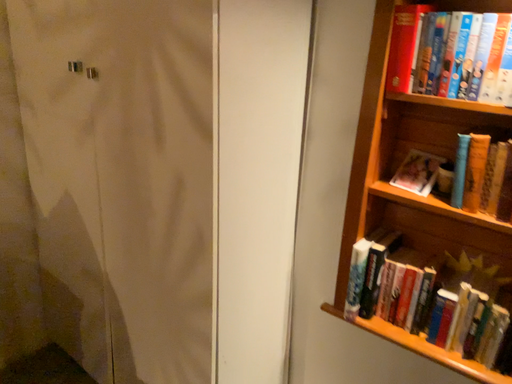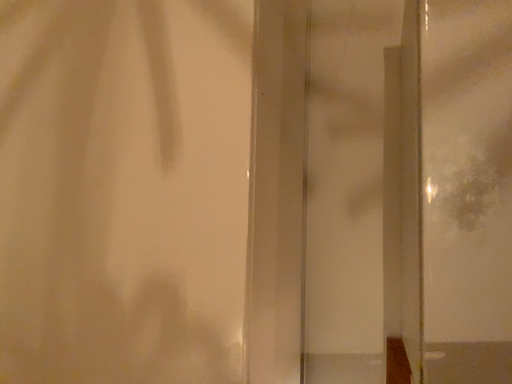
Question: How did the camera likely rotate when shooting the video?

Choices:
 (A) rotated right
 (B) rotated left

Answer: (A)